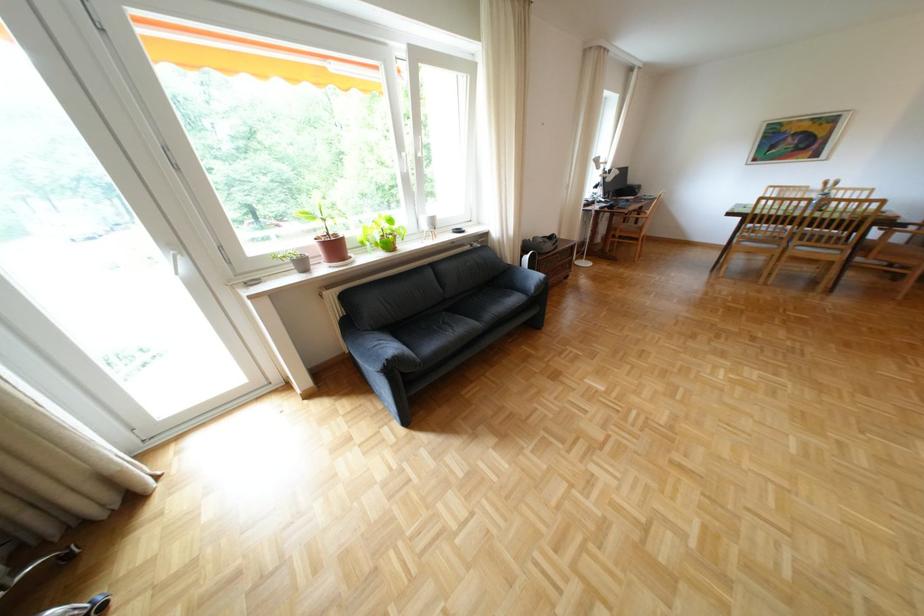
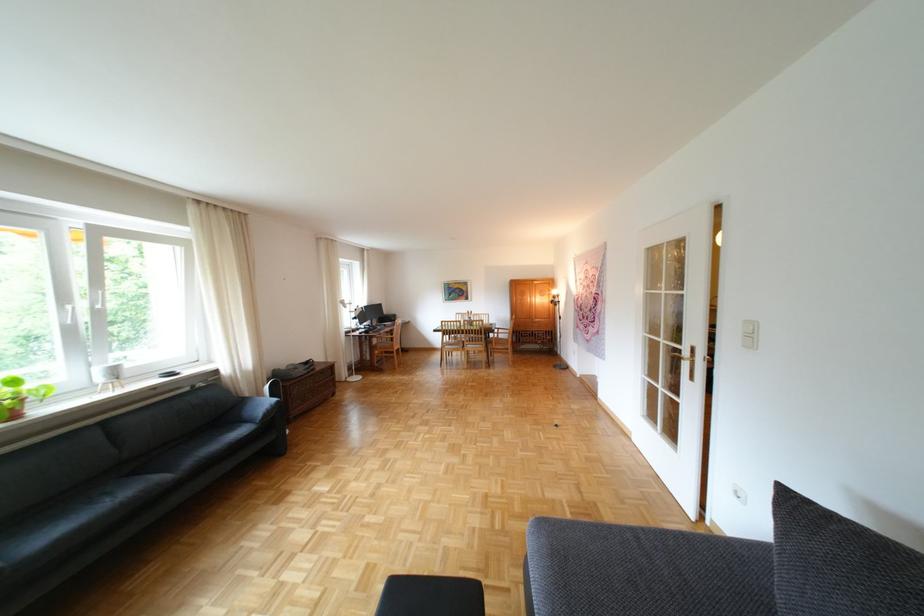
Locate, in the second image, the point that corresponds to point 536,291 in the first image.

(263, 421)